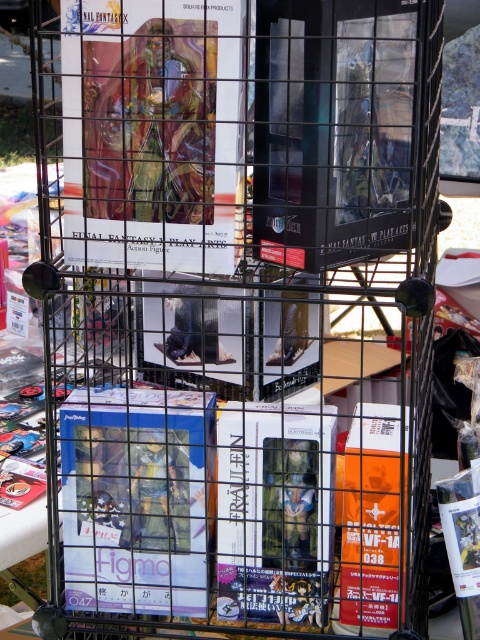
Which is in front, point (84, 115) or point (373, 516)?

Point (84, 115) is in front.

Is matte plastic poster at upper left to the left of orange matte vf-1 at lower right from the viewer's perspective?

Yes, matte plastic poster at upper left is to the left of orange matte vf-1 at lower right.

Where is `matte plastic poster at upper left`? The image size is (480, 640). matte plastic poster at upper left is located at coordinates (152, 131).

Can you confirm if matte plastic poster at upper left is thinner than matte plastic figure at center?

No, matte plastic poster at upper left is not thinner than matte plastic figure at center.

Which is more to the right, matte plastic poster at upper left or matte plastic figure at center?

Positioned to the right is matte plastic poster at upper left.

Is point (168, 0) closer to camera compared to point (83, 572)?

Yes, point (168, 0) is in front of point (83, 572).

Locate an element on the screen. matte plastic poster at upper left is located at coordinates (152, 131).

Is point (73, 227) behind point (228, 432)?

No.

Is point (74, 205) closer to viewer compared to point (276, 552)?

Yes, it is.

The width and height of the screenshot is (480, 640). Identify the location of matte plastic poster at upper left. (152, 131).